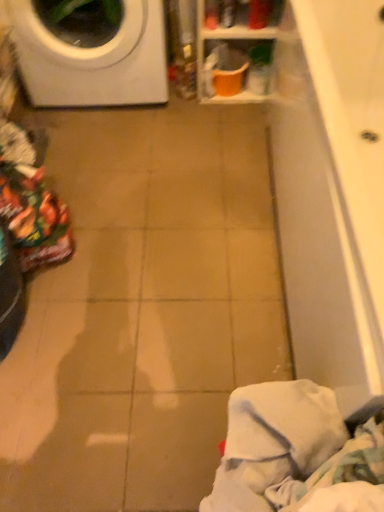
Question: Does white soft cloth at lower right contain white glossy washing machine at upper left?

Choices:
 (A) no
 (B) yes

Answer: (A)

Question: Is white soft cloth at lower right looking in the opposite direction of white glossy washing machine at upper left?

Choices:
 (A) yes
 (B) no

Answer: (B)

Question: Is white soft cloth at lower right next to white glossy washing machine at upper left?

Choices:
 (A) no
 (B) yes

Answer: (A)

Question: Is white soft cloth at lower right smaller than white glossy washing machine at upper left?

Choices:
 (A) no
 (B) yes

Answer: (B)

Question: From a real-world perspective, is white soft cloth at lower right under white glossy washing machine at upper left?

Choices:
 (A) no
 (B) yes

Answer: (A)

Question: Considering the relative sizes of white soft cloth at lower right and white glossy washing machine at upper left in the image provided, is white soft cloth at lower right wider than white glossy washing machine at upper left?

Choices:
 (A) no
 (B) yes

Answer: (A)

Question: From a real-world perspective, is white glossy washing machine at upper left on top of white soft cloth at lower right?

Choices:
 (A) yes
 (B) no

Answer: (B)

Question: From a real-world perspective, is white glossy washing machine at upper left below white soft cloth at lower right?

Choices:
 (A) yes
 (B) no

Answer: (A)

Question: Is white soft cloth at lower right at the back of white glossy washing machine at upper left?

Choices:
 (A) yes
 (B) no

Answer: (B)

Question: Does white glossy washing machine at upper left have a greater width compared to white soft cloth at lower right?

Choices:
 (A) no
 (B) yes

Answer: (B)

Question: Is white glossy washing machine at upper left positioned far away from white soft cloth at lower right?

Choices:
 (A) yes
 (B) no

Answer: (A)

Question: From the image's perspective, is white glossy washing machine at upper left beneath white soft cloth at lower right?

Choices:
 (A) no
 (B) yes

Answer: (A)

Question: Considering the relative positions of orange plastic bucket at upper center and white soft cloth at lower right in the image provided, is orange plastic bucket at upper center in front of white soft cloth at lower right?

Choices:
 (A) yes
 (B) no

Answer: (B)